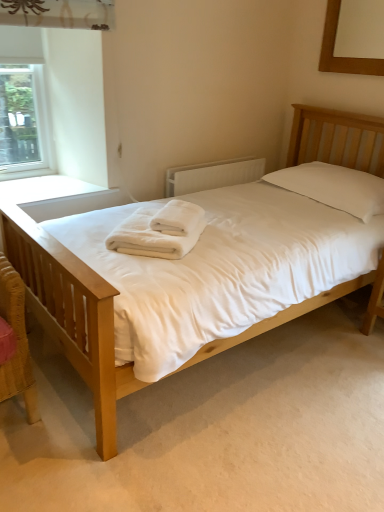
Question: From a real-world perspective, is white soft towel at center, placed as the 1th bath towel when sorted from top to bottom, physically above white textured radiator at center?

Choices:
 (A) yes
 (B) no

Answer: (A)

Question: Can you confirm if white soft towel at center, placed as the second bath towel when sorted from bottom to top, is wider than white textured radiator at center?

Choices:
 (A) no
 (B) yes

Answer: (B)

Question: Is white soft towel at center, placed as the second bath towel when sorted from bottom to top, oriented away from white textured radiator at center?

Choices:
 (A) no
 (B) yes

Answer: (A)

Question: From the image's perspective, does white soft towel at center, placed as the second bath towel when sorted from bottom to top, appear lower than white textured radiator at center?

Choices:
 (A) yes
 (B) no

Answer: (A)

Question: From the image's perspective, is white soft towel at center, placed as the 1th bath towel when sorted from top to bottom, over white textured radiator at center?

Choices:
 (A) no
 (B) yes

Answer: (A)

Question: Considering the relative positions of white soft towel at center, placed as the 1th bath towel when sorted from top to bottom, and white textured radiator at center in the image provided, is white soft towel at center, placed as the 1th bath towel when sorted from top to bottom, to the right of white textured radiator at center from the viewer's perspective?

Choices:
 (A) yes
 (B) no

Answer: (B)

Question: Is white soft towel at center, which appears as the second bath towel when viewed from the top, facing away from light wood bed at center?

Choices:
 (A) no
 (B) yes

Answer: (B)

Question: Can you confirm if white soft towel at center, which ranks as the first bath towel in bottom-to-top order, is positioned to the left of light wood bed at center?

Choices:
 (A) no
 (B) yes

Answer: (B)

Question: From a real-world perspective, is white soft towel at center, which appears as the second bath towel when viewed from the top, over light wood bed at center?

Choices:
 (A) no
 (B) yes

Answer: (B)

Question: Considering the relative sizes of white soft towel at center, which ranks as the first bath towel in bottom-to-top order, and light wood bed at center in the image provided, is white soft towel at center, which ranks as the first bath towel in bottom-to-top order, taller than light wood bed at center?

Choices:
 (A) no
 (B) yes

Answer: (A)

Question: Is white soft towel at center, which appears as the second bath towel when viewed from the top, to the right of light wood bed at center from the viewer's perspective?

Choices:
 (A) yes
 (B) no

Answer: (B)

Question: From a real-world perspective, is white soft towel at center, which appears as the second bath towel when viewed from the top, below light wood bed at center?

Choices:
 (A) yes
 (B) no

Answer: (B)

Question: From the image's perspective, does white soft towel at center, which appears as the second bath towel when viewed from the top, appear lower than clear glass window at upper left?

Choices:
 (A) yes
 (B) no

Answer: (A)